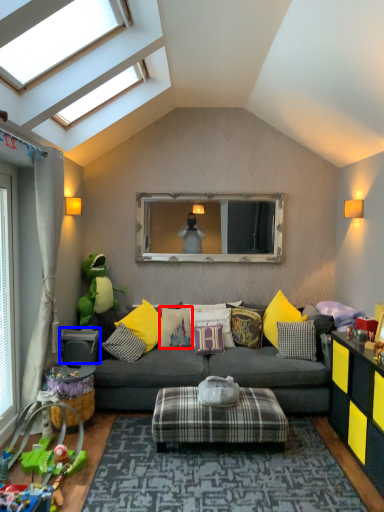
Question: Which point is closer to the camera, pillow (highlighted by a red box) or table (highlighted by a blue box)?

Choices:
 (A) pillow
 (B) table

Answer: (B)